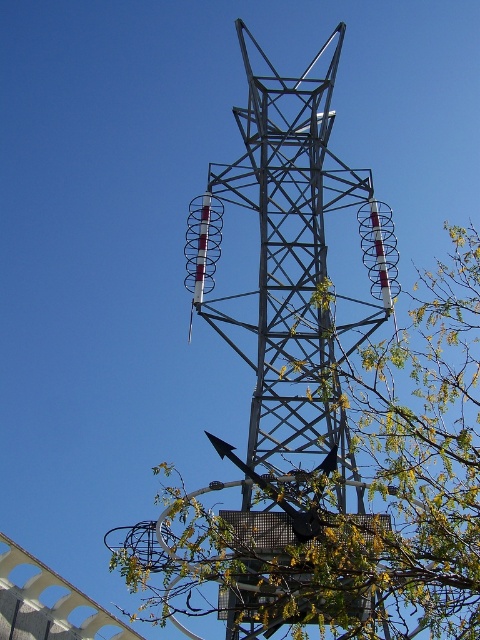
Is green leafy tree at center wider than metallic structure at center?

Yes.

Is green leafy tree at center below metallic structure at center?

Indeed, green leafy tree at center is positioned under metallic structure at center.

Is point (412, 573) positioned behind point (265, 385)?

No, it is not.

Where is `green leafy tree at center`? The image size is (480, 640). green leafy tree at center is located at coordinates (348, 509).